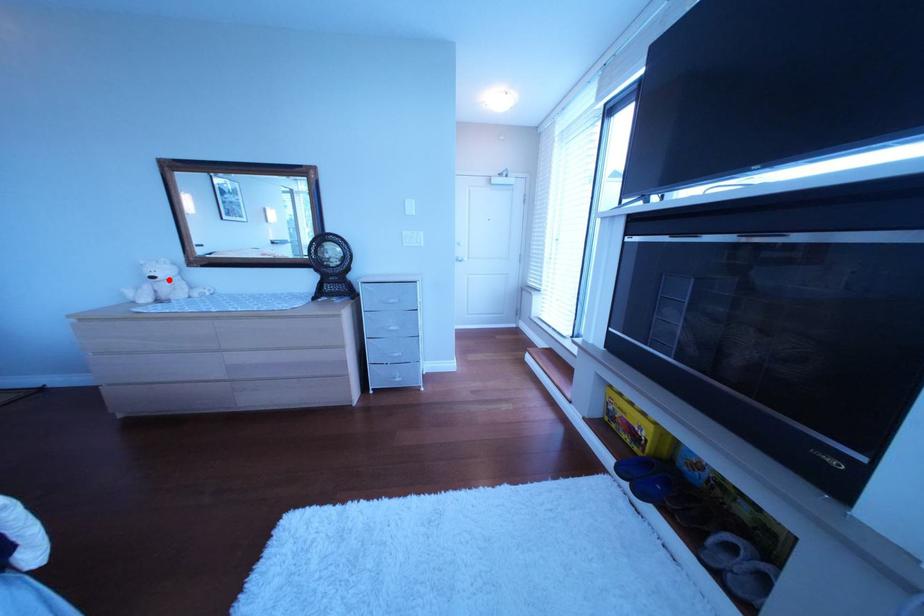
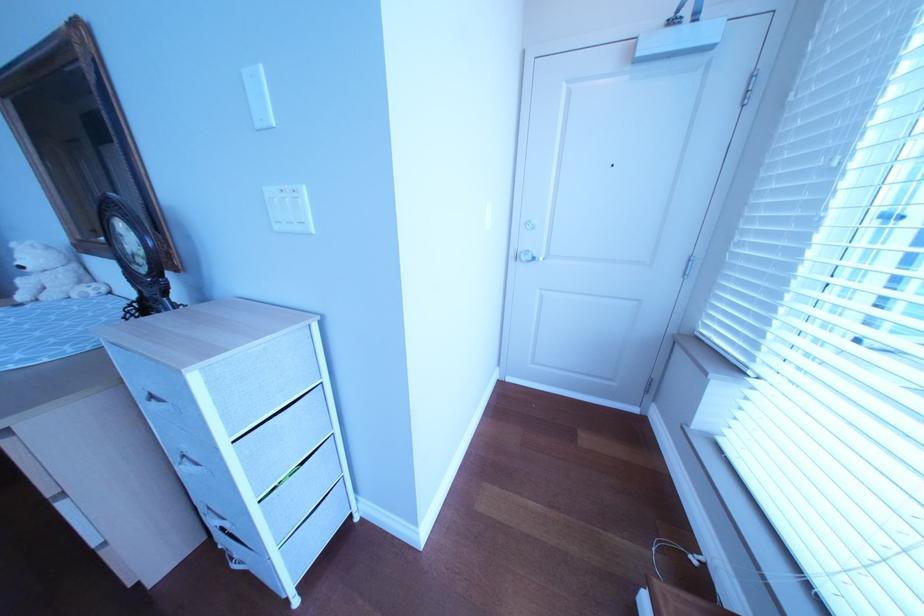
Question: I am providing you with two images of the same scene from different viewpoints. In image1, a red point is highlighted. Considering the same 3D point in image2, which of the following is correct?

Choices:
 (A) It is closer
 (B) It is farther

Answer: (A)